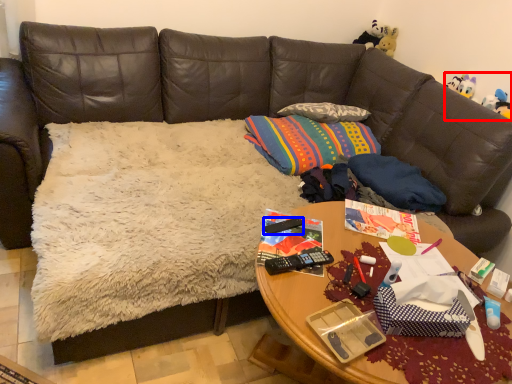
Question: Which of the following is the closest to the observer, toy (highlighted by a red box) or remote control (highlighted by a blue box)?

Choices:
 (A) toy
 (B) remote control

Answer: (B)